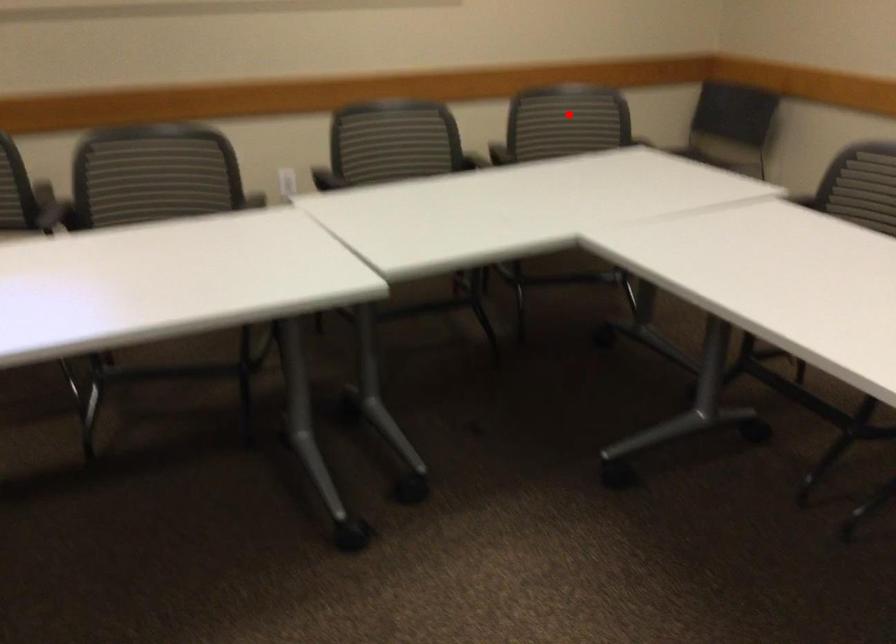
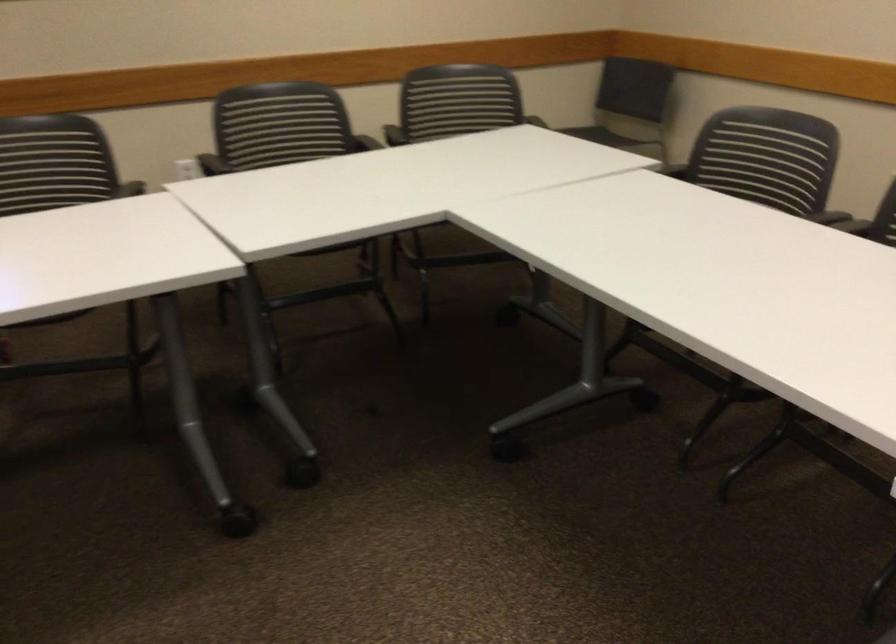
Question: I am providing you with two images of the same scene from different viewpoints. A red point is marked on the first image. At the location where the point appears in image 1, is it still visible in image 2?

Choices:
 (A) Yes
 (B) No

Answer: (B)